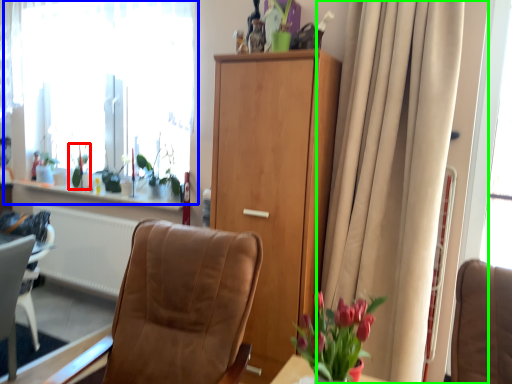
Question: Which is farther away from plant (highlighted by a red box)? window (highlighted by a blue box) or curtain (highlighted by a green box)?

Choices:
 (A) window
 (B) curtain

Answer: (B)